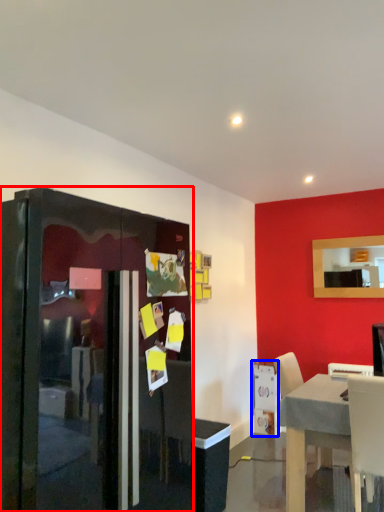
Question: Which point is closer to the camera, fridge (highlighted by a red box) or appliance (highlighted by a blue box)?

Choices:
 (A) fridge
 (B) appliance

Answer: (A)